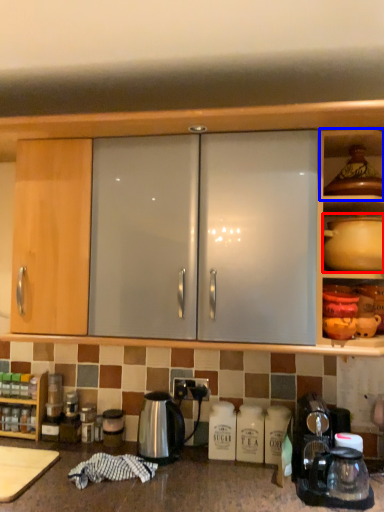
Question: Which object appears farthest to the camera in this image, coffeepot (highlighted by a red box) or shelf (highlighted by a blue box)?

Choices:
 (A) coffeepot
 (B) shelf

Answer: (B)